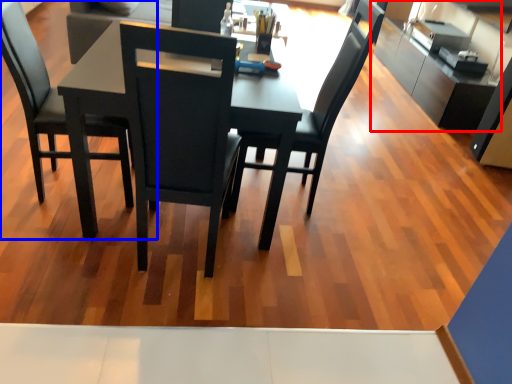
Question: Which of the following is the farthest to the observer, cabinetry (highlighted by a red box) or chair (highlighted by a blue box)?

Choices:
 (A) cabinetry
 (B) chair

Answer: (A)